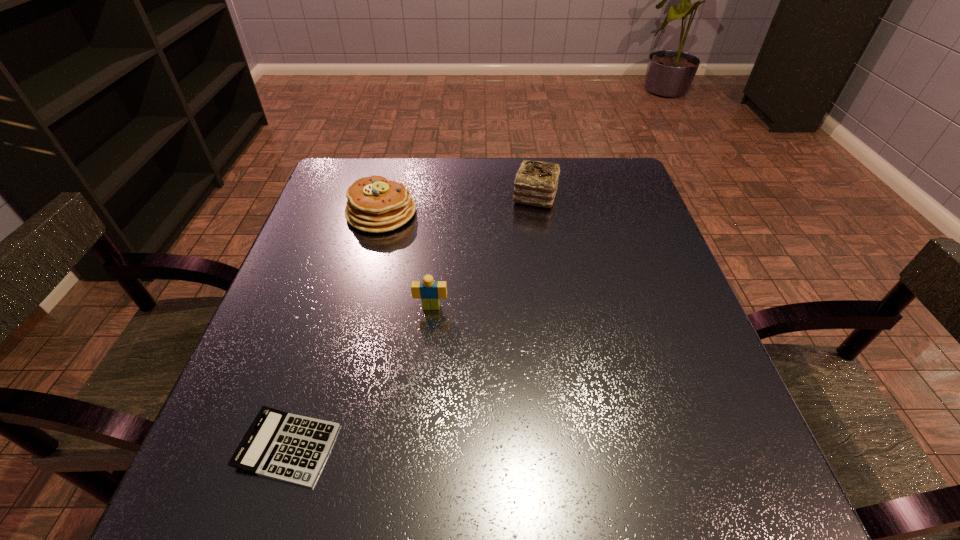
Identify the location of blank space at the right edge. This screenshot has width=960, height=540. (713, 368).

The width and height of the screenshot is (960, 540). In order to click on vacant space at the far left corner of the desktop in this screenshot , I will do `click(365, 167)`.

Where is `free space at the near left corner of the desktop`? The image size is (960, 540). free space at the near left corner of the desktop is located at coordinates (204, 481).

Identify the location of vacant space at the far right corner of the desktop. pos(622,165).

The image size is (960, 540). In the image, there is a desktop. Find the location of `free region at the near right corner`. free region at the near right corner is located at coordinates (757, 463).

Image resolution: width=960 pixels, height=540 pixels. I want to click on free point between the Lego and the shortest object, so click(359, 377).

At what (x,y) coordinates should I click in order to perform the action: click on free area in between the Lego and the pancake. Please return your answer as a coordinate pair (x, y). The height and width of the screenshot is (540, 960). Looking at the image, I should click on (406, 260).

In order to click on free space between the pancake and the second object from right to left in this screenshot , I will do `click(406, 260)`.

At what (x,y) coordinates should I click in order to perform the action: click on vacant area that lies between the shortest object and the third object from left to right. Please return your answer as a coordinate pair (x, y). The image size is (960, 540). Looking at the image, I should click on (359, 377).

Locate an element on the screen. unoccupied area between the pancake and the rightmost object is located at coordinates (459, 205).